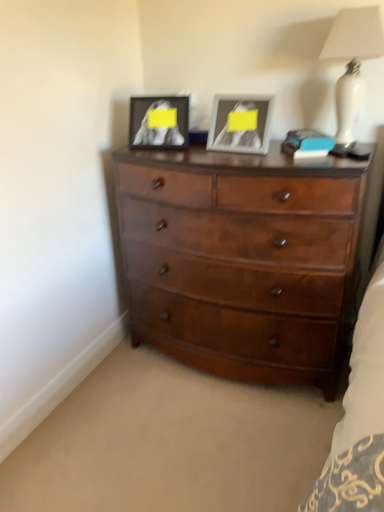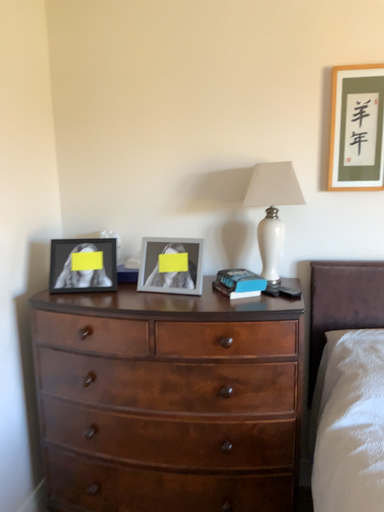
Question: Which way did the camera rotate in the video?

Choices:
 (A) rotated right
 (B) rotated left

Answer: (A)